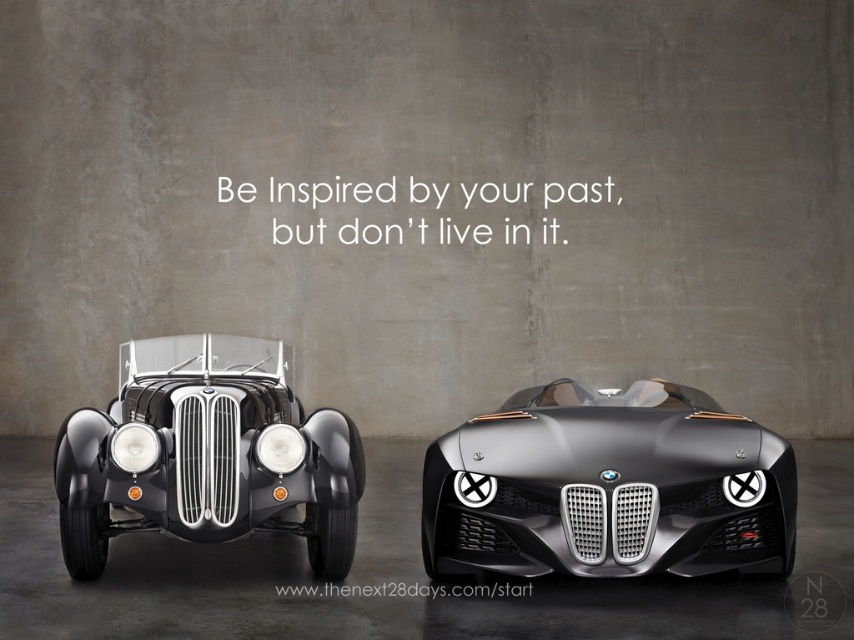
Question: Where is glossy black car at left located in relation to matte white headlight at center in the image?

Choices:
 (A) below
 (B) above

Answer: (B)

Question: Which of these objects is positioned closest to the matte white headlight at left?

Choices:
 (A) matte white headlight at center
 (B) glossy black car at left
 (C) shiny metallic sports car at center

Answer: (A)

Question: Which point is farther to the camera?

Choices:
 (A) (300, 416)
 (B) (595, 524)
 (C) (264, 451)
 (D) (141, 456)

Answer: (A)

Question: Does shiny metallic sports car at center appear on the left side of glossy black car at left?

Choices:
 (A) yes
 (B) no

Answer: (B)

Question: Does glossy black car at left have a lesser width compared to matte white headlight at left?

Choices:
 (A) no
 (B) yes

Answer: (A)

Question: Among these points, which one is farthest from the camera?

Choices:
 (A) (149, 360)
 (B) (303, 438)
 (C) (718, 413)

Answer: (A)